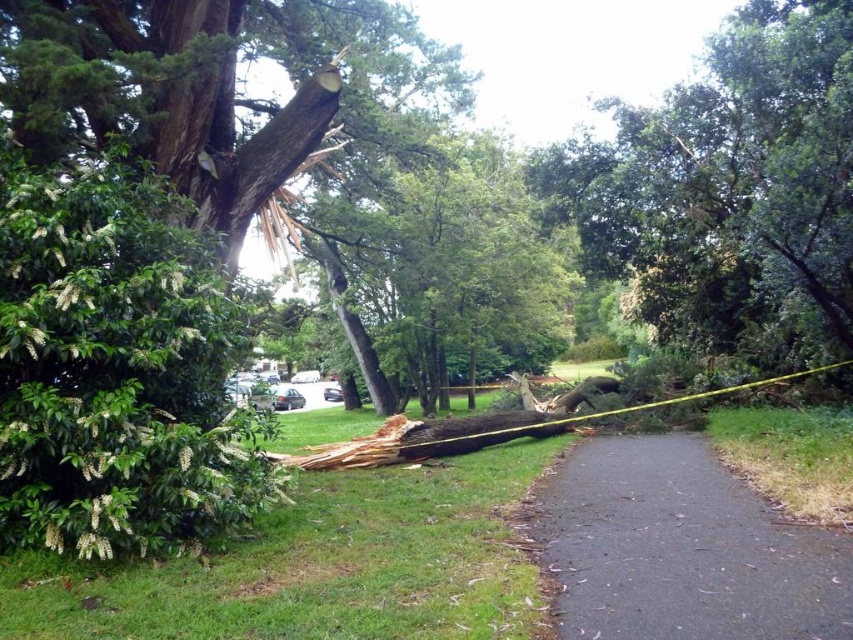
Question: Can you confirm if brown rough wood at center is smaller than black asphalt path at center?

Choices:
 (A) yes
 (B) no

Answer: (B)

Question: Is black asphalt path at center to the left of green textured trunk at center from the viewer's perspective?

Choices:
 (A) no
 (B) yes

Answer: (A)

Question: Which object is closer to the camera taking this photo?

Choices:
 (A) black asphalt path at center
 (B) brown rough wood at center
 (C) green textured trunk at center

Answer: (A)

Question: Does black asphalt path at center have a larger size compared to green textured trunk at center?

Choices:
 (A) yes
 (B) no

Answer: (B)

Question: Which of these objects is positioned farthest from the brown rough wood at center?

Choices:
 (A) black asphalt path at center
 (B) green textured trunk at center

Answer: (A)

Question: Among these points, which one is farthest from the camera?

Choices:
 (A) (477, 259)
 (B) (773, 90)
 (C) (589, 493)

Answer: (A)